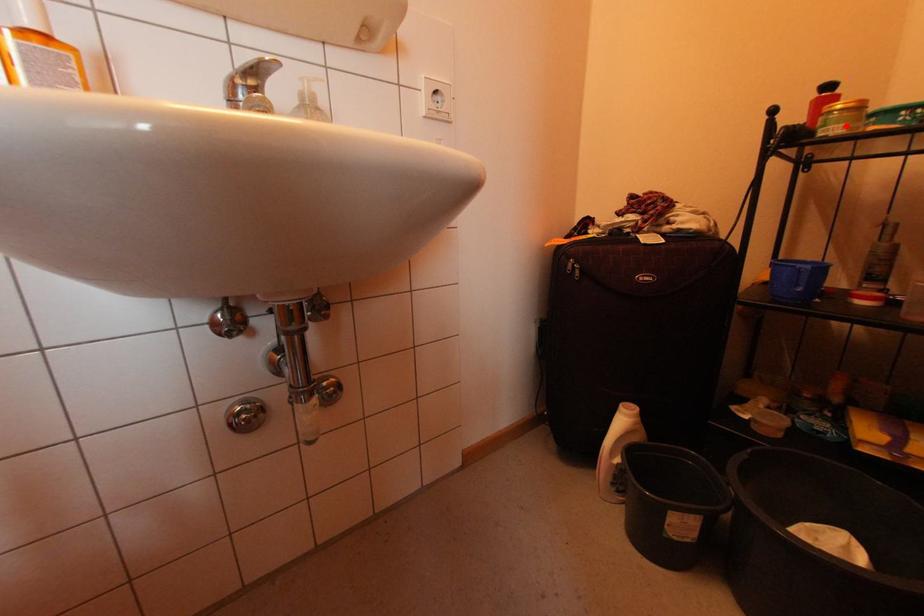
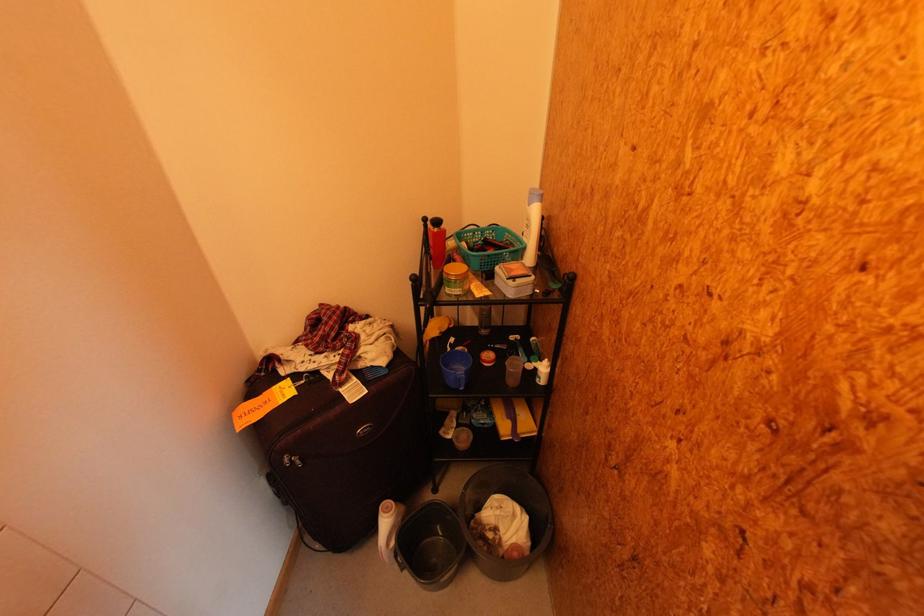
Locate, in the second image, the point that corresponds to the highlighted location in the first image.

(464, 291)